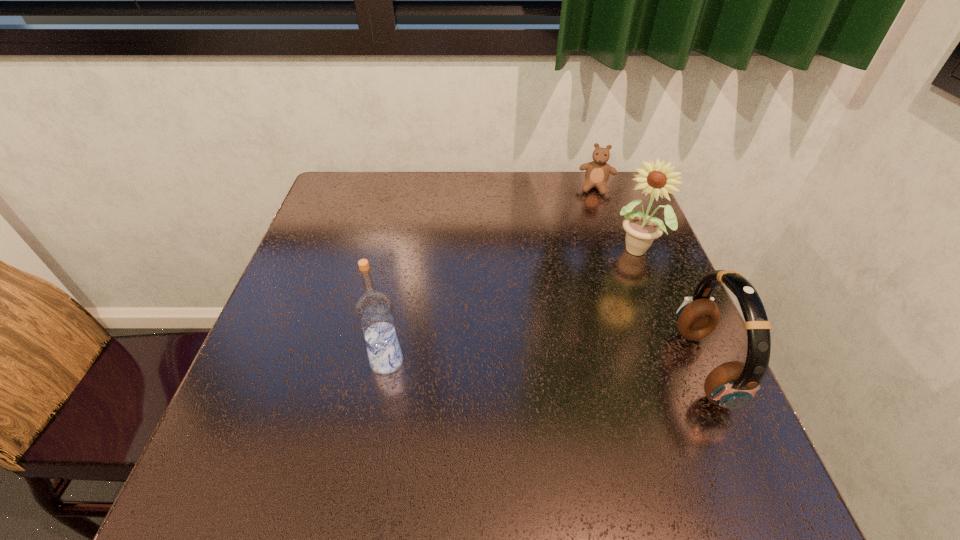
The height and width of the screenshot is (540, 960). Identify the location of the leftmost object. (374, 310).

Identify the location of headset. Image resolution: width=960 pixels, height=540 pixels. 732,385.

In order to click on sunflower in this screenshot , I will do `click(641, 230)`.

Where is `the shortest object`? the shortest object is located at coordinates (597, 172).

The width and height of the screenshot is (960, 540). In order to click on teddy bear in this screenshot , I will do [x=597, y=172].

At what (x,y) coordinates should I click in order to perform the action: click on vacant space located on the back of the vodka. Please return your answer as a coordinate pair (x, y). Looking at the image, I should click on (402, 276).

Where is `vacant position located 0.330m on the ear cup of the headset`? Image resolution: width=960 pixels, height=540 pixels. vacant position located 0.330m on the ear cup of the headset is located at coordinates (515, 367).

At what (x,y) coordinates should I click in order to perform the action: click on free spot located 0.290m on the ear cup of the headset. Please return your answer as a coordinate pair (x, y). This screenshot has height=540, width=960. Looking at the image, I should click on (536, 367).

Image resolution: width=960 pixels, height=540 pixels. What are the coordinates of `vacant space situated 0.140m on the ear cup of the headset` in the screenshot? It's located at (612, 367).

Where is `vacant region located on the front-facing side of the sunflower`? vacant region located on the front-facing side of the sunflower is located at coordinates (610, 299).